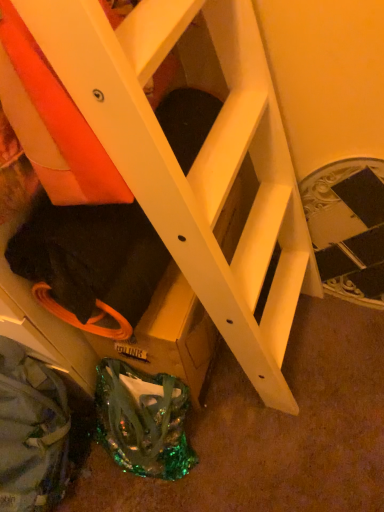
The width and height of the screenshot is (384, 512). I want to click on black textured stairwell at center, so pyautogui.click(x=348, y=228).

Describe the element at coordinates (348, 228) in the screenshot. The width and height of the screenshot is (384, 512). I see `black textured stairwell at center` at that location.

Measure the distance between point (362,224) and camera.

A distance of 1.17 meters exists between point (362,224) and camera.

What is the approximate width of black textured stairwell at center?

black textured stairwell at center is 3.27 inches in width.

Where is `shiny green fabric bag at lower center`? The image size is (384, 512). shiny green fabric bag at lower center is located at coordinates (143, 421).

What is the approximate height of shiny green fabric bag at lower center?

19.34 inches.

The image size is (384, 512). Describe the element at coordinates (143, 421) in the screenshot. I see `shiny green fabric bag at lower center` at that location.

At what (x,y) coordinates should I click in order to perform the action: click on black textured stairwell at center. Please return your answer as a coordinate pair (x, y). This screenshot has width=384, height=512. Looking at the image, I should click on (348, 228).

Is black textured stairwell at center to the left or to the right of shiny green fabric bag at lower center in the image?

In the image, black textured stairwell at center appears on the right side of shiny green fabric bag at lower center.

Is black textured stairwell at center in front of shiny green fabric bag at lower center?

No, the depth of black textured stairwell at center is greater than that of shiny green fabric bag at lower center.

Is point (333, 225) closer or farther from the camera than point (160, 386)?

Clearly, point (333, 225) is more distant from the camera than point (160, 386).

In the scene shown: From the image's perspective, is black textured stairwell at center on shiny green fabric bag at lower center?

Yes, from the image's perspective, black textured stairwell at center is above shiny green fabric bag at lower center.

From a real-world perspective, between black textured stairwell at center and shiny green fabric bag at lower center, who is vertically lower?

From a 3D spatial view, shiny green fabric bag at lower center is below.

Which object is wider, black textured stairwell at center or shiny green fabric bag at lower center?

shiny green fabric bag at lower center.

Is black textured stairwell at center taller than shiny green fabric bag at lower center?

Yes, black textured stairwell at center is taller than shiny green fabric bag at lower center.

Considering the relative sizes of black textured stairwell at center and shiny green fabric bag at lower center in the image provided, is black textured stairwell at center bigger than shiny green fabric bag at lower center?

Incorrect, black textured stairwell at center is not larger than shiny green fabric bag at lower center.

Is shiny green fabric bag at lower center surrounded by black textured stairwell at center?

No.

Are black textured stairwell at center and shiny green fabric bag at lower center far apart?

black textured stairwell at center is actually quite close to shiny green fabric bag at lower center.

Is black textured stairwell at center facing towards shiny green fabric bag at lower center?

No.

How different are the orientations of black textured stairwell at center and shiny green fabric bag at lower center in degrees?

The angle between the facing direction of black textured stairwell at center and the facing direction of shiny green fabric bag at lower center is 1.55 degrees.

How far apart are black textured stairwell at center and shiny green fabric bag at lower center?

A distance of 26.95 inches exists between black textured stairwell at center and shiny green fabric bag at lower center.

Image resolution: width=384 pixels, height=512 pixels. In the image, there is a black textured stairwell at center. Identify the location of bag below it (from a real-world perspective). (143, 421).

Between shiny green fabric bag at lower center and black textured stairwell at center, which one appears on the left side from the viewer's perspective?

shiny green fabric bag at lower center is more to the left.

Is shiny green fabric bag at lower center closer to the viewer compared to black textured stairwell at center?

That is True.

Is point (112, 364) positioned before point (356, 240)?

Yes, it is in front of point (356, 240).

From the image's perspective, does shiny green fabric bag at lower center appear higher than black textured stairwell at center?

No, from the image's perspective, shiny green fabric bag at lower center is not above black textured stairwell at center.

From a real-world perspective, is shiny green fabric bag at lower center over black textured stairwell at center?

No, from a real-world perspective, shiny green fabric bag at lower center is not over black textured stairwell at center

Considering the sizes of shiny green fabric bag at lower center and black textured stairwell at center in the image, is shiny green fabric bag at lower center wider or thinner than black textured stairwell at center?

shiny green fabric bag at lower center is wider than black textured stairwell at center.

Considering the relative sizes of shiny green fabric bag at lower center and black textured stairwell at center in the image provided, is shiny green fabric bag at lower center shorter than black textured stairwell at center?

Correct, shiny green fabric bag at lower center is not as tall as black textured stairwell at center.

Considering the relative sizes of shiny green fabric bag at lower center and black textured stairwell at center in the image provided, is shiny green fabric bag at lower center smaller than black textured stairwell at center?

Incorrect, shiny green fabric bag at lower center is not smaller in size than black textured stairwell at center.

Can we say shiny green fabric bag at lower center lies outside black textured stairwell at center?

Yes, shiny green fabric bag at lower center is not within black textured stairwell at center.

Are shiny green fabric bag at lower center and black textured stairwell at center far apart?

No, shiny green fabric bag at lower center is not far away from black textured stairwell at center.

Is shiny green fabric bag at lower center positioned with its back to black textured stairwell at center?

No.

The image size is (384, 512). I want to click on bag that is on the left side of black textured stairwell at center, so (143, 421).

The width and height of the screenshot is (384, 512). Identify the location of stairwell lying behind the shiny green fabric bag at lower center. (348, 228).

The image size is (384, 512). Identify the location of bag located in front of the black textured stairwell at center. (143, 421).